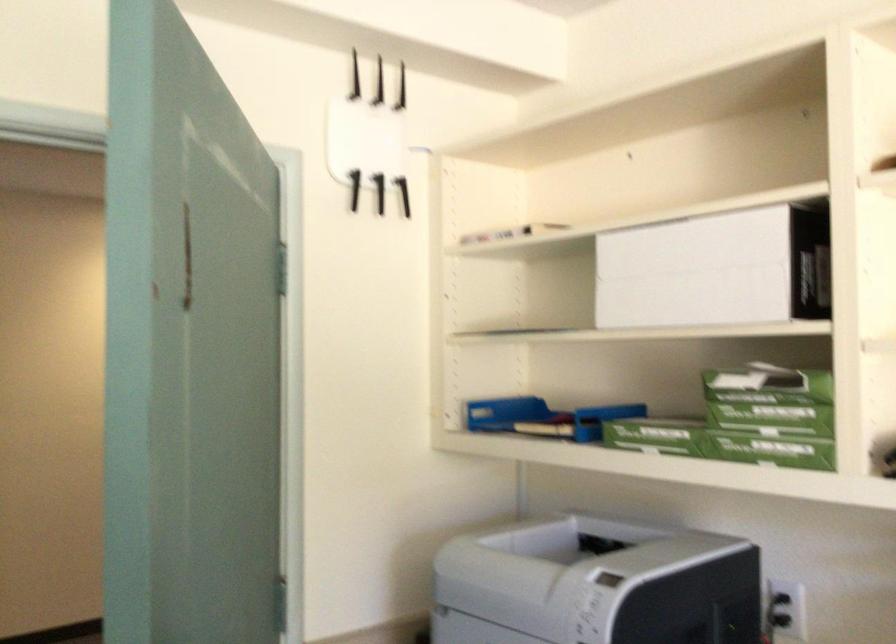
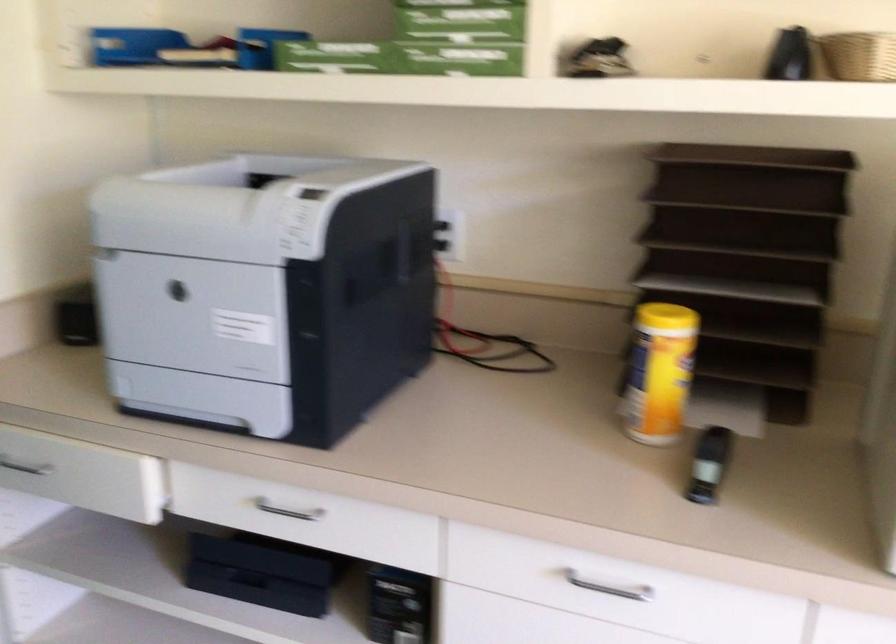
The first image is from the beginning of the video and the second image is from the end. How did the camera likely rotate when shooting the video?

The camera rotated toward right-down.